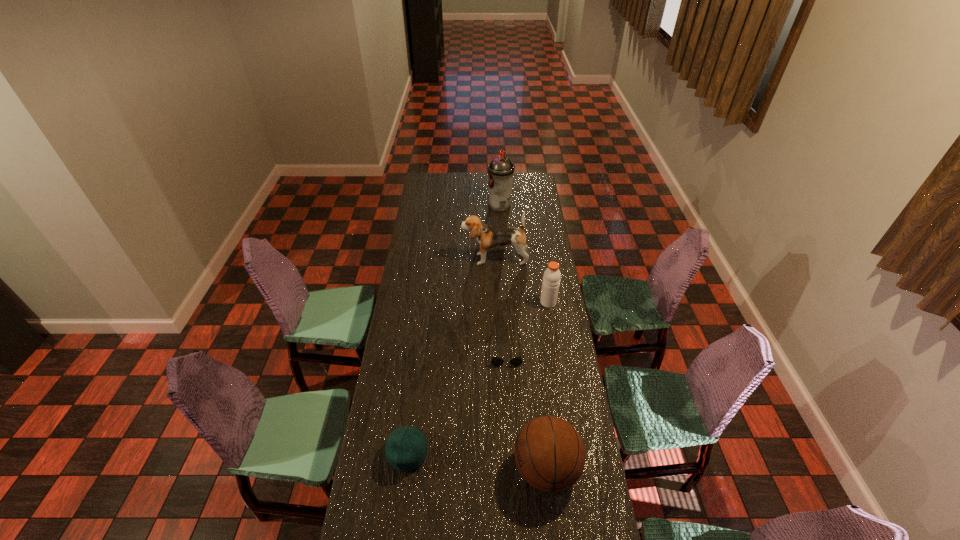
Identify the location of free space between the third nearest object and the fourth nearest object. (527, 326).

Locate an element on the screen. This screenshot has height=540, width=960. vacant space that is in between the basketball and the shaker is located at coordinates (547, 386).

The height and width of the screenshot is (540, 960). What are the coordinates of `vacant space that is in between the shaker and the beanie` in the screenshot? It's located at (478, 378).

Where is `vacant area between the leftmost object and the sunglasses`? This screenshot has height=540, width=960. vacant area between the leftmost object and the sunglasses is located at coordinates (457, 402).

Locate an element on the screen. vacant region between the second shortest object and the farthest object is located at coordinates (454, 330).

Find the location of a particular element. blank region between the leftmost object and the fourth nearest object is located at coordinates (478, 378).

Identify which object is the fifth nearest to the basketball. Please provide its 2D coordinates. Your answer should be formatted as a tuple, i.e. [(x, y)], where the tuple contains the x and y coordinates of a point satisfying the conditions above.

[(500, 170)]

You are a GUI agent. You are given a task and a screenshot of the screen. Output one action in this format:
    pyautogui.click(x=<x>, y=<y>)
    Task: Click on the object that is the fourth nearest to the basketball
    This screenshot has height=540, width=960.
    Given the screenshot: What is the action you would take?
    pyautogui.click(x=488, y=237)

Locate an element on the screen. The height and width of the screenshot is (540, 960). free space that satisfies the following two spatial constraints: 1. at the face of the second farthest object; 2. on the left side of the fourth nearest object is located at coordinates (495, 302).

Locate an element on the screen. vacant space that satisfies the following two spatial constraints: 1. at the face of the second farthest object; 2. on the front side of the beanie is located at coordinates (501, 454).